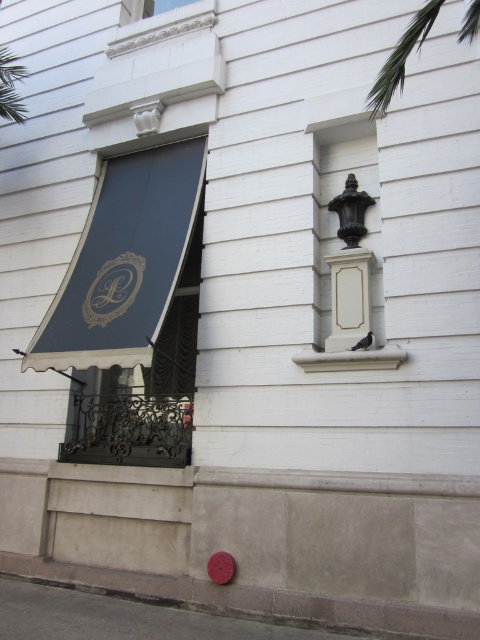
Question: Among these points, which one is nearest to the camera?

Choices:
 (A) (419, 24)
 (B) (305, 353)
 (C) (187, 385)

Answer: (A)

Question: Is dark blue fabric awning at left to the left of white stone window sill at center from the viewer's perspective?

Choices:
 (A) no
 (B) yes

Answer: (B)

Question: Which of these objects is positioned farthest from the white stone window sill at center?

Choices:
 (A) dark blue fabric awning at left
 (B) green leafy palm tree at upper right

Answer: (B)

Question: Is dark blue fabric awning at left above green leafy palm tree at upper right?

Choices:
 (A) no
 (B) yes

Answer: (A)

Question: Which point is farther to the camera?

Choices:
 (A) (439, 1)
 (B) (182, 305)

Answer: (B)

Question: Where is dark blue fabric awning at left located in relation to white stone window sill at center in the image?

Choices:
 (A) above
 (B) below

Answer: (A)